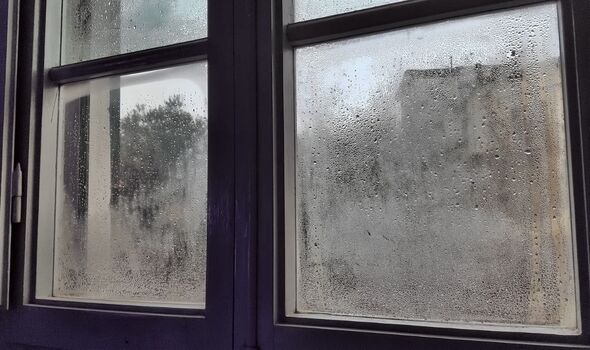
Identify the location of bottom left window. The height and width of the screenshot is (350, 590). (160, 212).